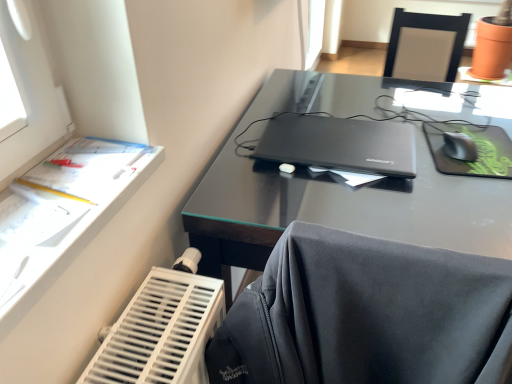
Question: From a real-world perspective, is black plastic mouse at right above or below glossy black desk at center?

Choices:
 (A) above
 (B) below

Answer: (A)

Question: Considering the positions of black plastic mouse at right and glossy black desk at center in the image, is black plastic mouse at right wider or thinner than glossy black desk at center?

Choices:
 (A) wide
 (B) thin

Answer: (B)

Question: Which object is positioned farthest from the matte black laptop at center?

Choices:
 (A) glossy black desk at center
 (B) white paper at left
 (C) black matte mouse pad at right
 (D) black plastic mouse at right

Answer: (B)

Question: Which of these objects is positioned closest to the black matte mouse pad at right?

Choices:
 (A) black plastic mouse at right
 (B) white paper at left
 (C) glossy black desk at center
 (D) matte black laptop at center

Answer: (A)